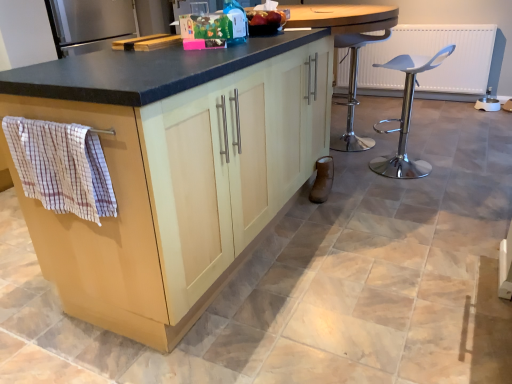
You are a GUI agent. You are given a task and a screenshot of the screen. Output one action in this format:
    pyautogui.click(x=<x>, y=<y>)
    Task: Click on the vacant area located to the right-hand side of white plastic stool at right
    This screenshot has height=384, width=512.
    Given the screenshot: What is the action you would take?
    pyautogui.click(x=450, y=165)